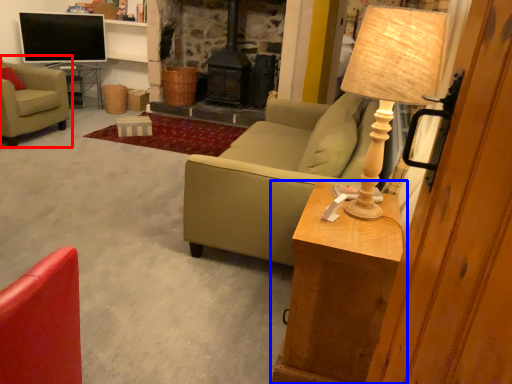
Question: Among these objects, which one is nearest to the camera, chair (highlighted by a red box) or table (highlighted by a blue box)?

Choices:
 (A) chair
 (B) table

Answer: (B)